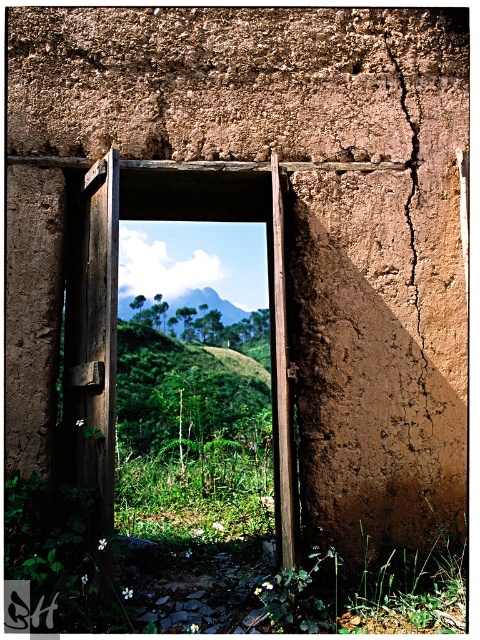
Question: Is wooden door at center to the right of brown cracked wall at right from the viewer's perspective?

Choices:
 (A) yes
 (B) no

Answer: (B)

Question: Does wooden door at center come in front of green grassy hillside at center?

Choices:
 (A) no
 (B) yes

Answer: (B)

Question: Which object is the farthest from the wooden door at center?

Choices:
 (A) brown cracked wall at right
 (B) green grassy hillside at center

Answer: (B)

Question: Which of these objects is positioned closest to the brown cracked wall at right?

Choices:
 (A) green grassy hillside at center
 (B) wooden door at center

Answer: (B)

Question: Which point is closer to the camera?

Choices:
 (A) (399, 72)
 (B) (123, 305)
 (C) (90, 211)

Answer: (C)

Question: Is wooden door at center to the left of brown cracked wall at right from the viewer's perspective?

Choices:
 (A) no
 (B) yes

Answer: (B)